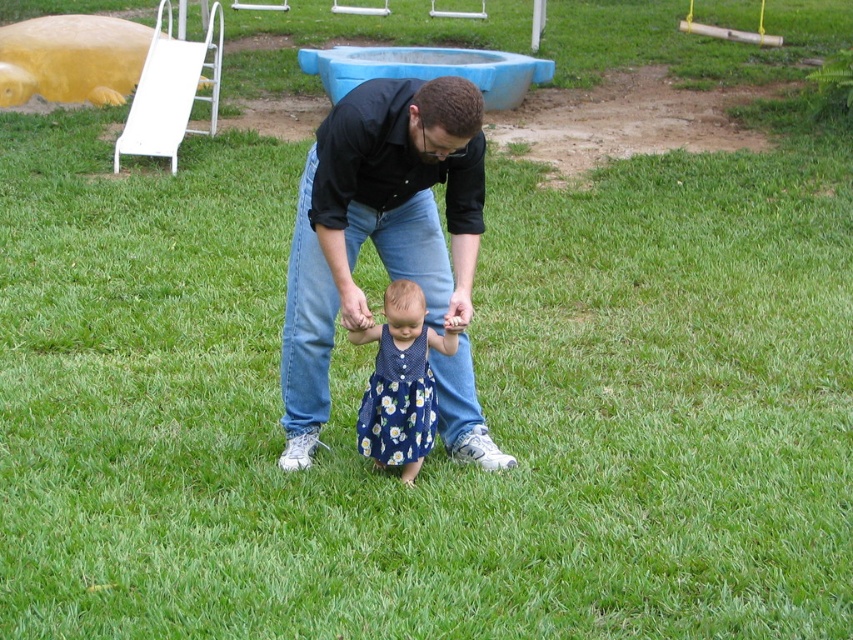
Between black cotton shirt at center and blue floral dress at center, which one is positioned lower?

blue floral dress at center is below.

Looking at this image, can you confirm if black cotton shirt at center is shorter than blue floral dress at center?

In fact, black cotton shirt at center may be taller than blue floral dress at center.

Is point (341, 147) closer to viewer compared to point (419, 342)?

Yes, point (341, 147) is closer to viewer.

Where is `black cotton shirt at center`? The width and height of the screenshot is (853, 640). black cotton shirt at center is located at coordinates (376, 225).